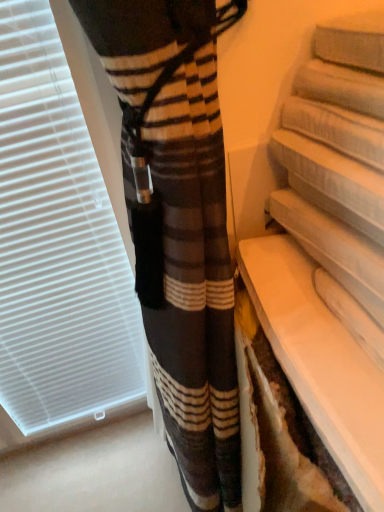
The height and width of the screenshot is (512, 384). Find the location of `empty space that is ontop of white glossy shelf at lower right`. empty space that is ontop of white glossy shelf at lower right is located at coordinates (339, 313).